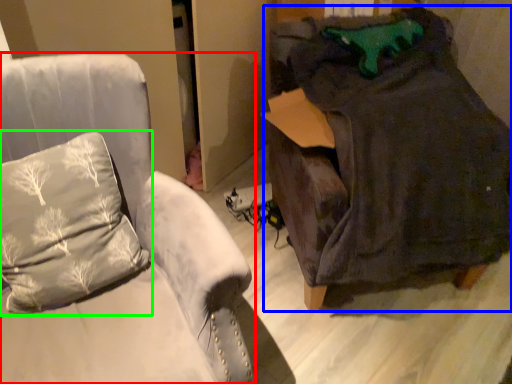
Question: Estimate the real-world distances between objects in this image. Which object is farther from furniture (highlighted by a red box), bean bag chair (highlighted by a blue box) or pillow (highlighted by a green box)?

Choices:
 (A) bean bag chair
 (B) pillow

Answer: (A)